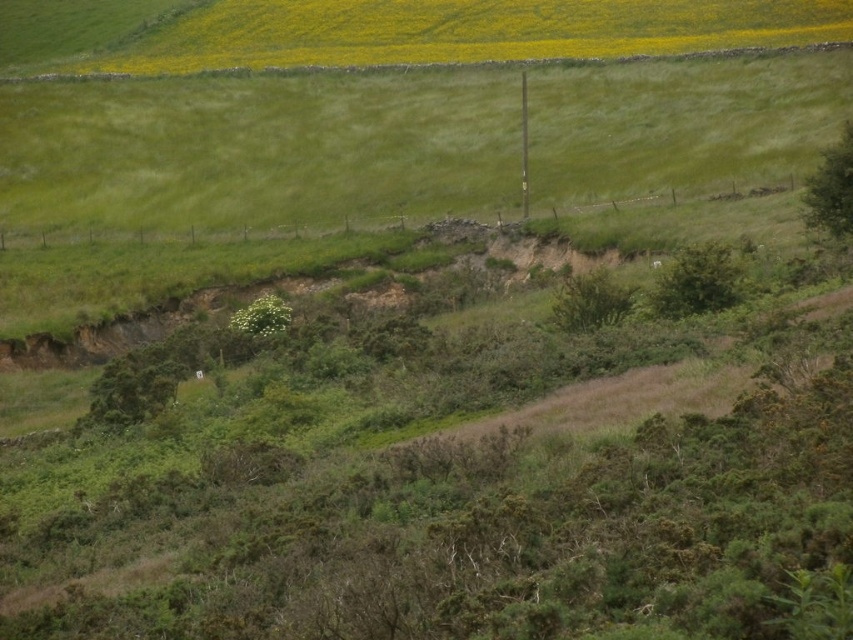
Question: Can you confirm if green grassy hillside at upper center is positioned above green leafy plant at center?

Choices:
 (A) yes
 (B) no

Answer: (A)

Question: Does green grassy hillside at upper center come behind green leafy plant at center?

Choices:
 (A) yes
 (B) no

Answer: (A)

Question: Which object is closer to the camera taking this photo?

Choices:
 (A) green grassy hillside at upper center
 (B) green leafy plant at center

Answer: (B)

Question: Does green grassy hillside at upper center have a greater width compared to green leafy plant at center?

Choices:
 (A) no
 (B) yes

Answer: (B)

Question: Which object is closer to the camera taking this photo?

Choices:
 (A) green grassy hillside at upper center
 (B) green leafy plant at center

Answer: (B)